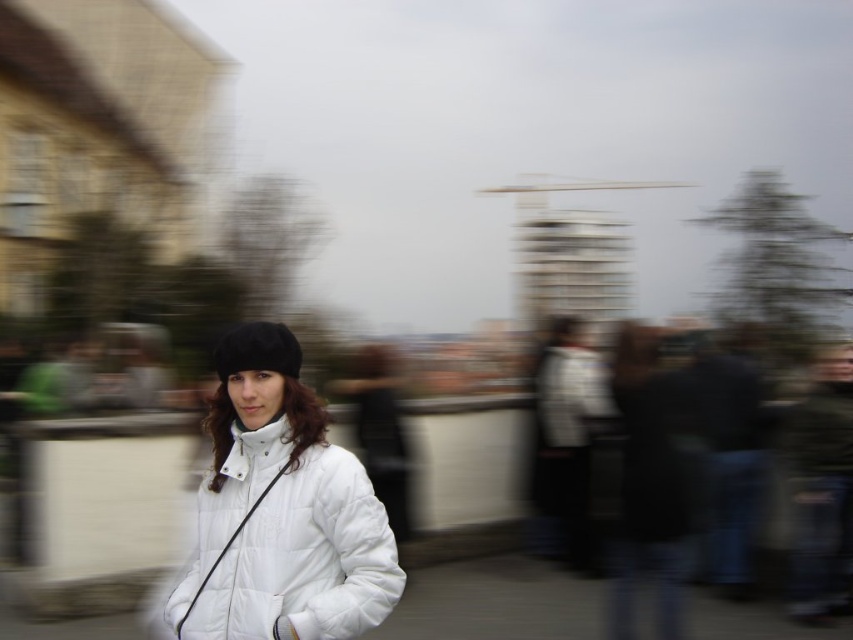
Question: Which of the following is the farthest from the observer?

Choices:
 (A) (254, 609)
 (B) (225, 349)

Answer: (B)

Question: Which point appears farthest from the camera in this image?

Choices:
 (A) (x=201, y=596)
 (B) (x=259, y=348)
 (C) (x=506, y=584)

Answer: (C)

Question: Does white fabric jacket at lower center appear on the right side of black fuzzy hat at center?

Choices:
 (A) yes
 (B) no

Answer: (A)

Question: Which point is farther from the camera taking this photo?

Choices:
 (A) (219, 353)
 (B) (180, 636)
 (C) (381, 627)

Answer: (C)

Question: Is white puffy jacket at center to the left of white fabric jacket at lower center from the viewer's perspective?

Choices:
 (A) no
 (B) yes

Answer: (B)

Question: Does white fabric jacket at lower center appear on the right side of black fuzzy hat at center?

Choices:
 (A) yes
 (B) no

Answer: (A)